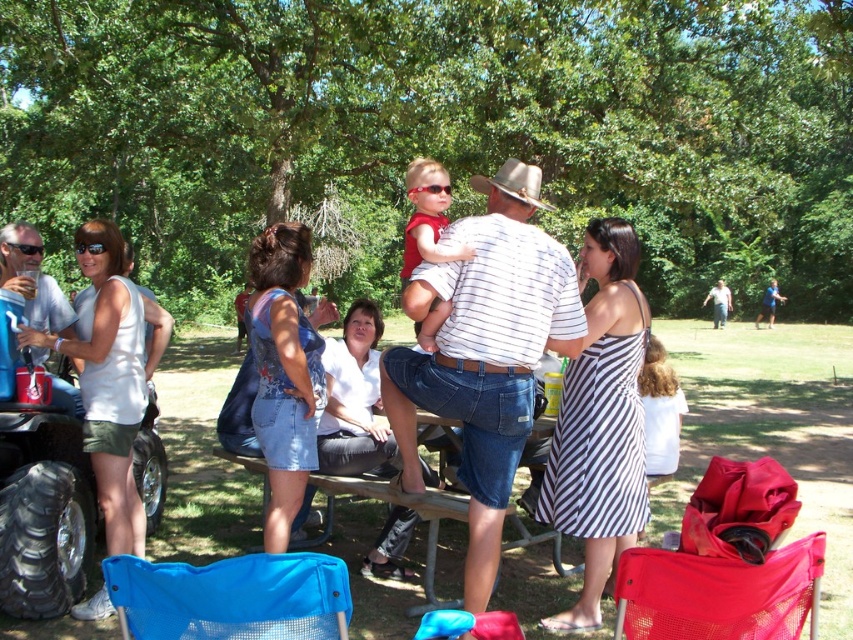
Question: Can you confirm if striped cotton shirt at center is positioned below brushed metal mug at upper left?

Choices:
 (A) yes
 (B) no

Answer: (A)

Question: Which of these objects is positioned closest to the black and white striped dress at center?

Choices:
 (A) blue denim shorts at center
 (B) striped cotton shirt at center
 (C) white fabric tank top at left

Answer: (B)

Question: Is striped cotton shirt at center to the left of matte red shirt at center from the viewer's perspective?

Choices:
 (A) no
 (B) yes

Answer: (A)

Question: Does striped cotton shirt at center appear on the right side of white fabric tank top at left?

Choices:
 (A) yes
 (B) no

Answer: (A)

Question: Based on their relative distances, which object is nearer to the blue denim shorts at center?

Choices:
 (A) striped cotton shirt at center
 (B) brushed metal mug at upper left
 (C) matte white shirt at center
 (D) brown felt cowboy hat at center

Answer: (A)

Question: Among these objects, which one is farthest from the camera?

Choices:
 (A) striped cotton shirt at center
 (B) brown felt cowboy hat at center
 (C) blue denim shorts at center
 (D) brushed metal mug at upper left

Answer: (D)